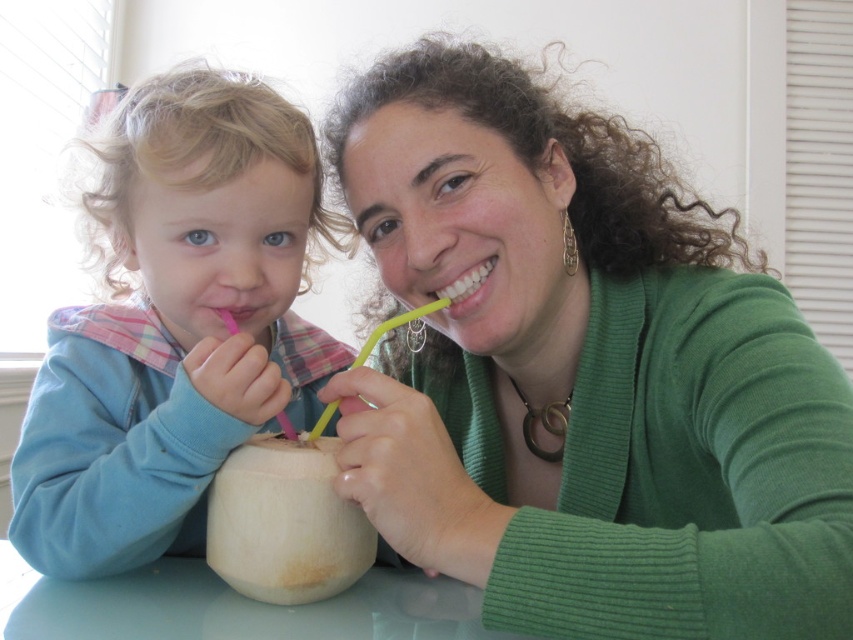
What do you see at coordinates (285, 522) in the screenshot?
I see `white matte coconut at center` at bounding box center [285, 522].

Can you confirm if white matte coconut at center is wider than yellow plastic straw at center?

No, white matte coconut at center is not wider than yellow plastic straw at center.

Between point (288, 516) and point (410, 316), which one is positioned behind?

Point (410, 316)

You are a GUI agent. You are given a task and a screenshot of the screen. Output one action in this format:
    pyautogui.click(x=<x>, y=<y>)
    Task: Click on the white matte coconut at center
    This screenshot has height=640, width=853.
    Given the screenshot: What is the action you would take?
    pyautogui.click(x=285, y=522)

Between point (270, 408) and point (425, 308), which one is positioned in front?

Positioned in front is point (270, 408).

Which is behind, point (224, 88) or point (332, 410)?

Point (224, 88)

Where is `blue fleece jacket at left`? The width and height of the screenshot is (853, 640). blue fleece jacket at left is located at coordinates (175, 324).

Who is lower down, green ribbed sweater at center or glossy plastic table at center?

glossy plastic table at center

Does green ribbed sweater at center have a lesser width compared to glossy plastic table at center?

Correct, green ribbed sweater at center's width is less than glossy plastic table at center's.

Find the location of `green ribbed sweater at center`. green ribbed sweater at center is located at coordinates (582, 374).